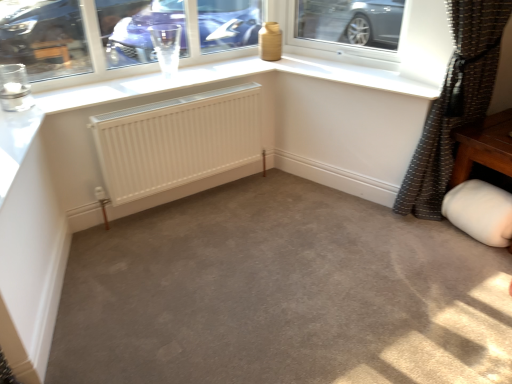
Locate an element on the screen. free space to the left of brown textured curtain at right is located at coordinates (331, 219).